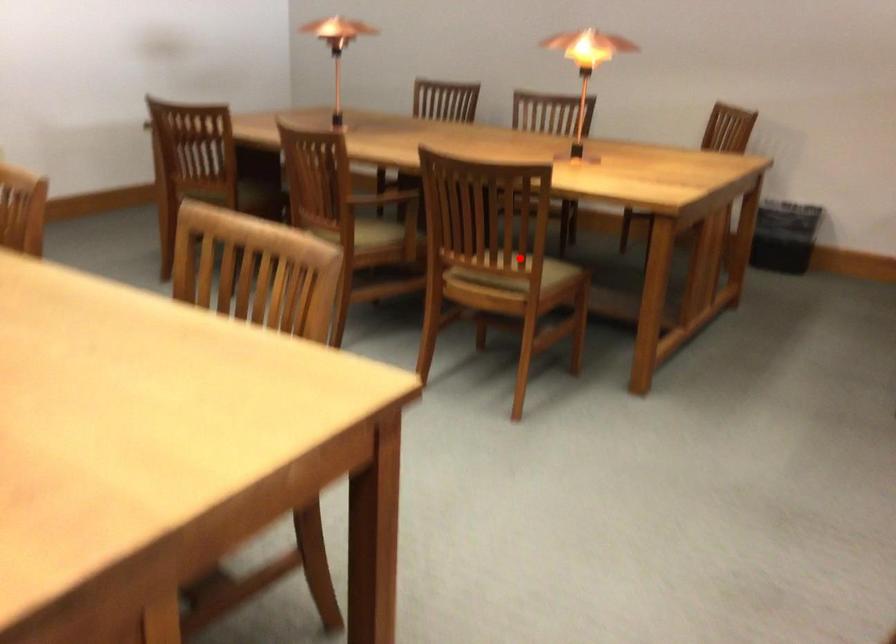
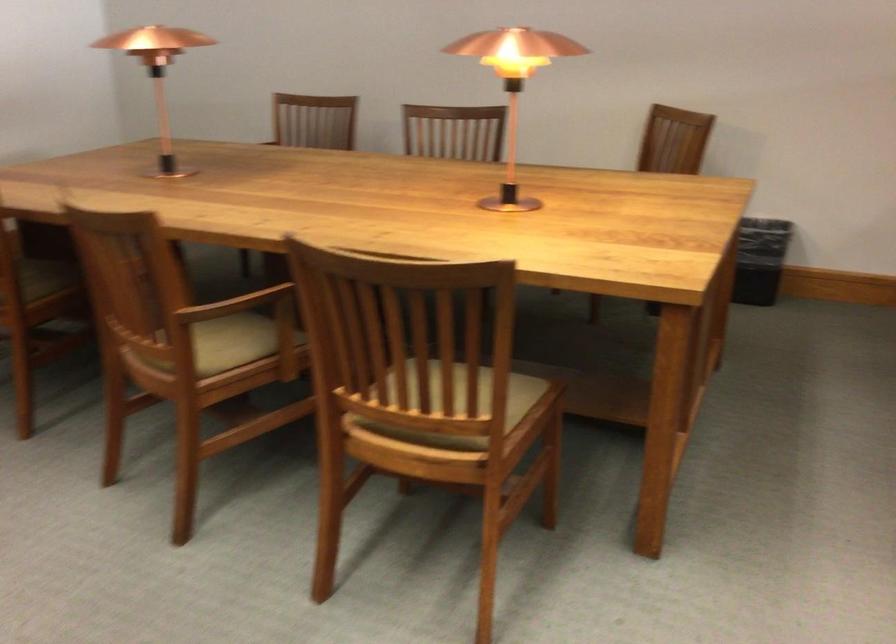
Question: I am providing you with two images of the same scene from different viewpoints. A red point is shown in image1. For the corresponding object point in image2, is it positioned nearer or farther from the camera?

Choices:
 (A) Nearer
 (B) Farther

Answer: (A)